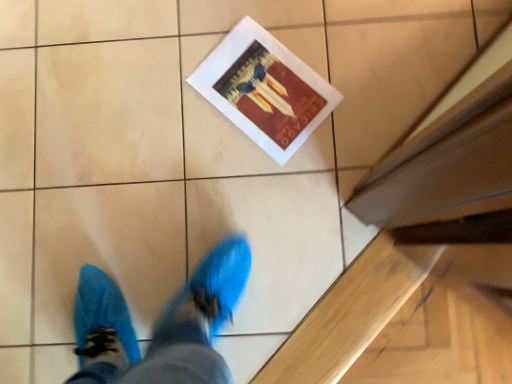
The image size is (512, 384). What are the coordinates of `vacant area located to the right-hand side of matte paper postcard at center` in the screenshot? It's located at (357, 60).